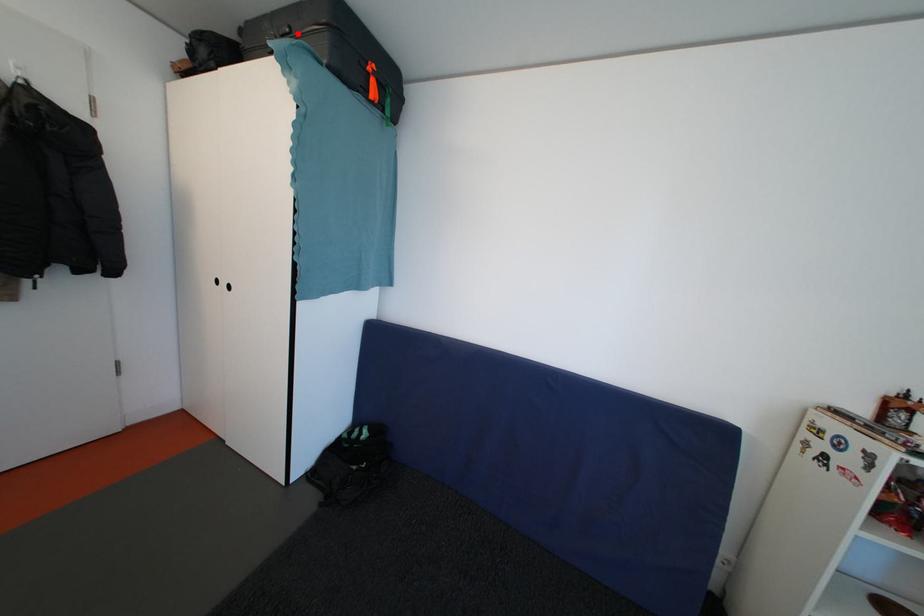
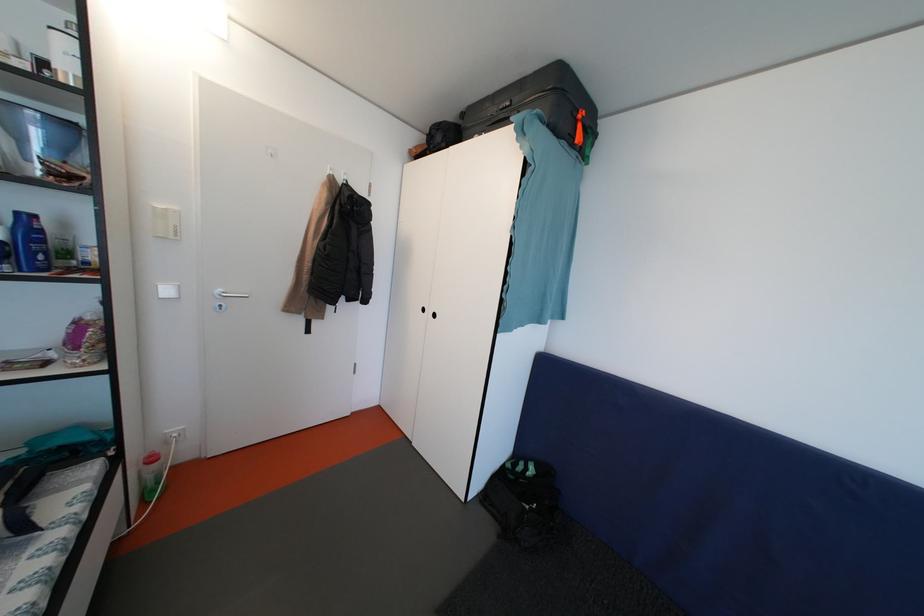
Question: I am providing you with two images of the same scene from different viewpoints. A red point is shown in image1. For the corresponding object point in image2, is it positioned nearer or farther from the camera?

Choices:
 (A) Nearer
 (B) Farther

Answer: (A)